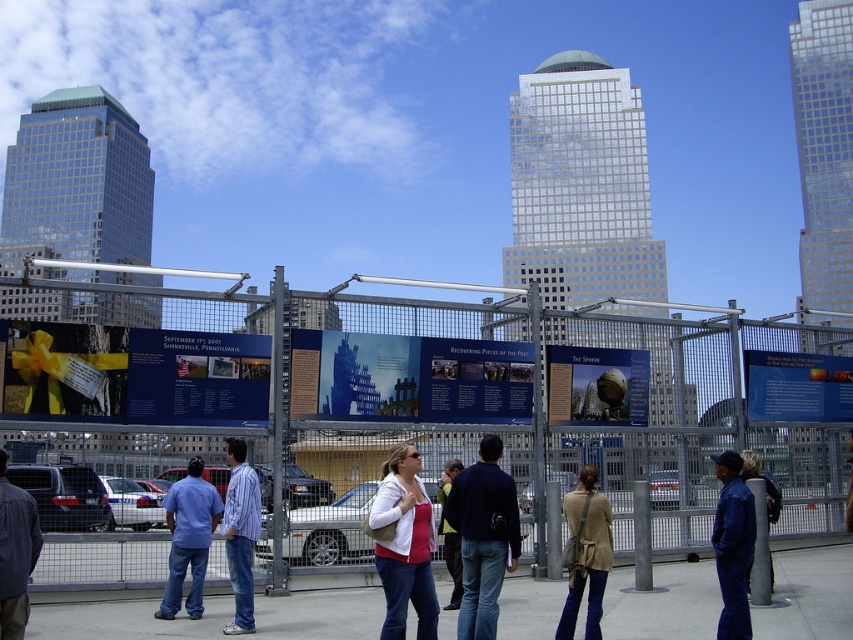
Can you confirm if dark blue jacket at center is smaller than matte white jacket at center?

No, dark blue jacket at center is not smaller than matte white jacket at center.

Who is more distant from viewer, (461, 634) or (436, 614)?

Positioned behind is point (461, 634).

Identify the location of dark blue jacket at center. (483, 536).

Is point (167, 600) positioned in front of point (773, 490)?

Yes, it is in front of point (773, 490).

Is blue jeans at center smaller than blue denim jeans at lower right?

No, blue jeans at center is not smaller than blue denim jeans at lower right.

Does point (184, 561) come closer to viewer compared to point (772, 484)?

Yes, point (184, 561) is in front of point (772, 484).

This screenshot has width=853, height=640. What are the coordinates of `blue jeans at center` in the screenshot? It's located at (189, 538).

From the picture: Is blue jeans at center to the right of beige leather jacket at lower center from the viewer's perspective?

In fact, blue jeans at center is to the left of beige leather jacket at lower center.

You are a GUI agent. You are given a task and a screenshot of the screen. Output one action in this format:
    pyautogui.click(x=<x>, y=<y>)
    Task: Click on the blue jeans at center
    This screenshot has width=853, height=640.
    Given the screenshot: What is the action you would take?
    pyautogui.click(x=189, y=538)

Image resolution: width=853 pixels, height=640 pixels. What do you see at coordinates (189, 538) in the screenshot?
I see `blue jeans at center` at bounding box center [189, 538].

The width and height of the screenshot is (853, 640). Identify the location of blue jeans at center. (189, 538).